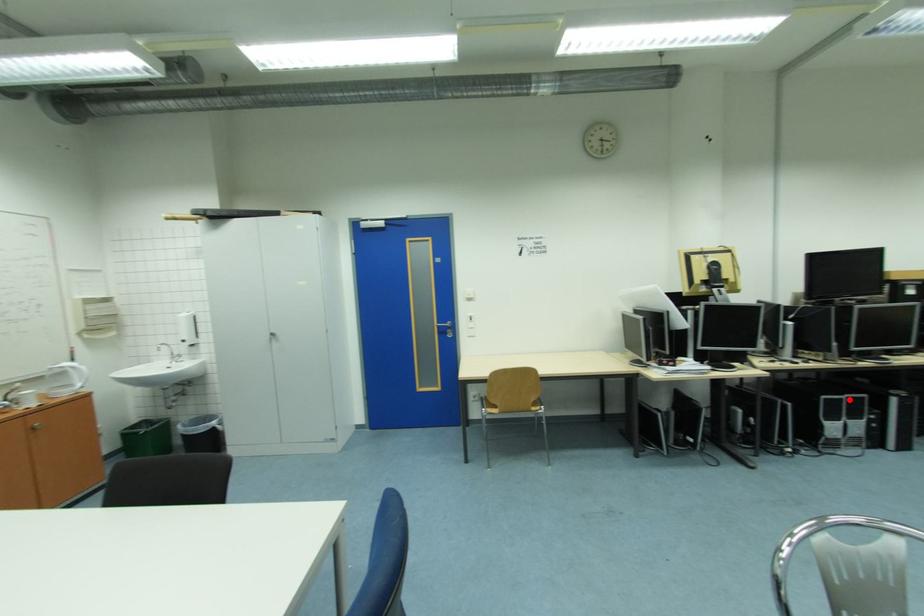
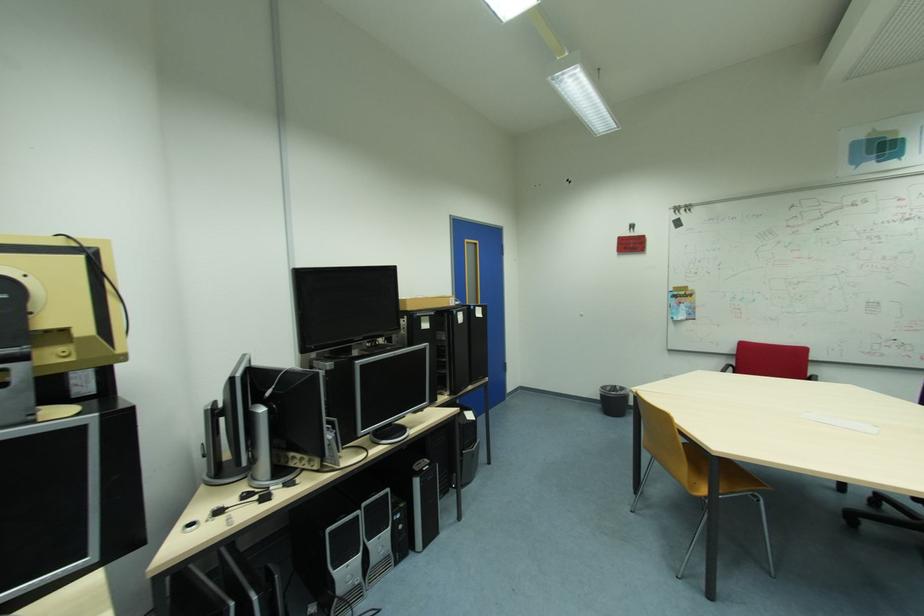
Question: I am providing you with two images of the same scene from different viewpoints. Image1 has a red point marked. In image2, the corresponding 3D location appears at what relative position? Reply with the corresponding letter.

Choices:
 (A) Closer
 (B) Farther

Answer: (B)